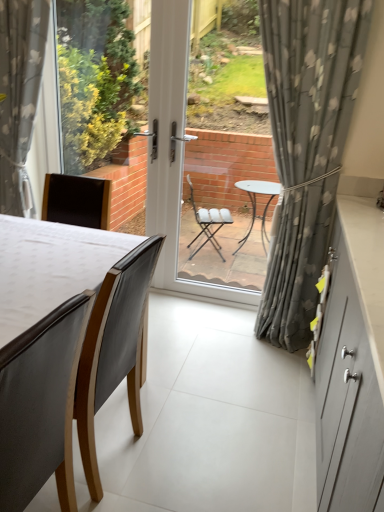
Question: Is matte black chair at left, which ranks as the first chair in back-to-front order, positioned beyond the bounds of gray floral fabric curtain at left, acting as the first curtain starting from the left?

Choices:
 (A) no
 (B) yes

Answer: (B)

Question: Is there a large distance between matte black chair at left, which ranks as the first chair in back-to-front order, and gray floral fabric curtain at left, acting as the first curtain starting from the left?

Choices:
 (A) no
 (B) yes

Answer: (B)

Question: Is matte black chair at left, which ranks as the first chair in back-to-front order, looking in the opposite direction of gray floral fabric curtain at left, which is the second curtain from right to left?

Choices:
 (A) yes
 (B) no

Answer: (B)

Question: Considering the relative sizes of matte black chair at left, acting as the 2th chair starting from the front, and gray floral fabric curtain at left, acting as the first curtain starting from the left, in the image provided, is matte black chair at left, acting as the 2th chair starting from the front, shorter than gray floral fabric curtain at left, acting as the first curtain starting from the left,?

Choices:
 (A) no
 (B) yes

Answer: (B)

Question: Considering the relative sizes of matte black chair at left, acting as the 2th chair starting from the front, and gray floral fabric curtain at left, acting as the first curtain starting from the left, in the image provided, is matte black chair at left, acting as the 2th chair starting from the front, smaller than gray floral fabric curtain at left, acting as the first curtain starting from the left,?

Choices:
 (A) no
 (B) yes

Answer: (A)

Question: From the image's perspective, is matte black chair at left, which ranks as the first chair in back-to-front order, under gray floral fabric curtain at left, which is the second curtain from right to left?

Choices:
 (A) no
 (B) yes

Answer: (B)

Question: Is transparent glass door at center surrounding matte gray cabinet at right?

Choices:
 (A) no
 (B) yes

Answer: (A)

Question: Does transparent glass door at center touch matte gray cabinet at right?

Choices:
 (A) yes
 (B) no

Answer: (B)

Question: Considering the relative sizes of transparent glass door at center and matte gray cabinet at right in the image provided, is transparent glass door at center shorter than matte gray cabinet at right?

Choices:
 (A) yes
 (B) no

Answer: (B)

Question: Considering the relative sizes of transparent glass door at center and matte gray cabinet at right in the image provided, is transparent glass door at center bigger than matte gray cabinet at right?

Choices:
 (A) no
 (B) yes

Answer: (A)

Question: From the image's perspective, is transparent glass door at center on top of matte gray cabinet at right?

Choices:
 (A) no
 (B) yes

Answer: (B)

Question: Considering the relative positions of transparent glass door at center and matte gray cabinet at right in the image provided, is transparent glass door at center in front of matte gray cabinet at right?

Choices:
 (A) no
 (B) yes

Answer: (A)

Question: Could gray floral fabric curtain at left, which is the second curtain from right to left, be considered to be inside dark brown leather chair at lower left, placed as the first chair when sorted from front to back?

Choices:
 (A) no
 (B) yes

Answer: (A)